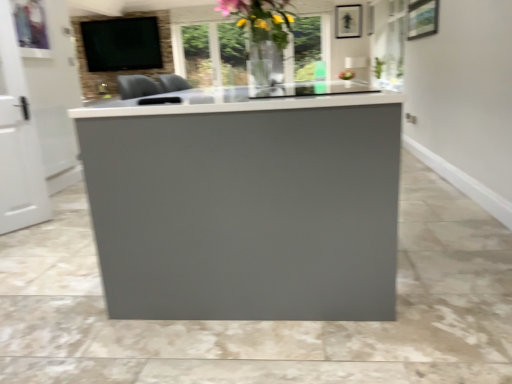
You are a GUI agent. You are given a task and a screenshot of the screen. Output one action in this format:
    pyautogui.click(x=<x>, y=<y>)
    Task: Click on the matte black tv at upper left
    
    Given the screenshot: What is the action you would take?
    pyautogui.click(x=122, y=44)

The height and width of the screenshot is (384, 512). I want to click on translucent glass vase at upper center, so click(263, 34).

The image size is (512, 384). Describe the element at coordinates (18, 141) in the screenshot. I see `white glossy door at left` at that location.

The height and width of the screenshot is (384, 512). Find the location of `matte black tv at upper left`. matte black tv at upper left is located at coordinates (122, 44).

Does point (9, 187) appear closer or farther from the camera than point (94, 56)?

Point (9, 187) is closer to the camera than point (94, 56).

From the picture: Looking at their sizes, would you say white glossy door at left is wider or thinner than matte black tv at upper left?

Considering their sizes, white glossy door at left looks slimmer than matte black tv at upper left.

How different are the orientations of white glossy door at left and matte black tv at upper left in degrees?

The facing directions of white glossy door at left and matte black tv at upper left are 57.9 degrees apart.

Which is closer, [257,74] or [2,229]?

The point [257,74] is closer to the camera.

Is translucent glass vase at upper center positioned before white glossy door at left?

Yes.

Is translucent glass vase at upper center far from white glossy door at left?

translucent glass vase at upper center is positioned a significant distance from white glossy door at left.

Would you say translucent glass vase at upper center is to the left or to the right of white glossy door at left in the picture?

translucent glass vase at upper center is positioned on white glossy door at left's right side.

Which point is more forward, (377,65) or (16,65)?

The point (16,65) is in front.

Would you say green leafy plant at upper right contains white glossy door at left?

That's incorrect, white glossy door at left is not inside green leafy plant at upper right.

Is green leafy plant at upper right facing away from white glossy door at left?

No, green leafy plant at upper right is not facing away from white glossy door at left.

From a real-world perspective, relative to white glossy door at left, is green leafy plant at upper right vertically above or below?

In terms of real-world spatial position, green leafy plant at upper right is above white glossy door at left.

Which of these two, translucent glass vase at upper center or green leafy plant at upper right, is bigger?

translucent glass vase at upper center is bigger.

Considering the positions of point (268, 31) and point (383, 69), is point (268, 31) closer or farther from the camera than point (383, 69)?

Point (268, 31) is positioned closer to the camera compared to point (383, 69).

Does translucent glass vase at upper center have a lesser height compared to green leafy plant at upper right?

Incorrect, the height of translucent glass vase at upper center does not fall short of that of green leafy plant at upper right.

Based on the photo, from the image's perspective, is translucent glass vase at upper center on top of green leafy plant at upper right?

Actually, translucent glass vase at upper center appears below green leafy plant at upper right in the image.

Looking at this image, based on their positions, is green leafy plant at upper right located to the left or right of translucent glass vase at upper center?

In the image, green leafy plant at upper right appears on the right side of translucent glass vase at upper center.

Is point (376, 77) positioned behind point (258, 18)?

Yes, it is.

From a real-world perspective, between green leafy plant at upper right and translucent glass vase at upper center, who is vertically lower?

In real-world perspective, green leafy plant at upper right is lower.

Is green leafy plant at upper right beside translucent glass vase at upper center?

No, green leafy plant at upper right is not making contact with translucent glass vase at upper center.

Which object is positioned more to the left, matte black tv at upper left or translucent glass vase at upper center?

Positioned to the left is matte black tv at upper left.

Is matte black tv at upper left inside or outside of translucent glass vase at upper center?

matte black tv at upper left exists outside the volume of translucent glass vase at upper center.

Does matte black tv at upper left touch translucent glass vase at upper center?

matte black tv at upper left and translucent glass vase at upper center are clearly separated.

Looking at the image, does matte black tv at upper left seem bigger or smaller compared to translucent glass vase at upper center?

Clearly, matte black tv at upper left is larger in size than translucent glass vase at upper center.

Which of these two, green leafy plant at upper right or matte black picture frame at upper center, is wider?

green leafy plant at upper right.

Is green leafy plant at upper right bigger or smaller than matte black picture frame at upper center?

Clearly, green leafy plant at upper right is larger in size than matte black picture frame at upper center.

Could you tell me if green leafy plant at upper right is turned towards matte black picture frame at upper center?

No.

At what (x,y) coordinates should I click in order to perform the action: click on glass door located underneath the matte black tv at upper left (from a real-world perspective). Please return your answer as a coordinate pair (x, y). The height and width of the screenshot is (384, 512). Looking at the image, I should click on (18, 141).

You are a GUI agent. You are given a task and a screenshot of the screen. Output one action in this format:
    pyautogui.click(x=<x>, y=<y>)
    Task: Click on the glass door below the translucent glass vase at upper center (from the image's perspective)
    The height and width of the screenshot is (384, 512).
    Given the screenshot: What is the action you would take?
    pyautogui.click(x=18, y=141)

Estimate the real-world distances between objects in this image. Which object is further from matte black picture frame at upper center, green leafy plant at upper right or matte black tv at upper left?

matte black tv at upper left lies further to matte black picture frame at upper center than the other object.

Looking at this image, considering their positions, is white glossy door at left positioned closer to matte black tv at upper left than matte black picture frame at upper center?

white glossy door at left is positioned closer to the anchor matte black tv at upper left.

From the image, which object appears to be farther from green leafy plant at upper right, white glossy door at left or matte black tv at upper left?

white glossy door at left is further to green leafy plant at upper right.

Considering their positions, is matte black picture frame at upper center positioned further to green leafy plant at upper right than white glossy door at left?

Among the two, white glossy door at left is located further to green leafy plant at upper right.

Looking at the image, which one is located closer to matte black tv at upper left, translucent glass vase at upper center or matte black picture frame at upper center?

The object closer to matte black tv at upper left is translucent glass vase at upper center.

Considering their positions, is green leafy plant at upper right positioned further to white glossy door at left than translucent glass vase at upper center?

green leafy plant at upper right lies further to white glossy door at left than the other object.

Considering their positions, is matte black tv at upper left positioned closer to green leafy plant at upper right than matte black picture frame at upper center?

matte black picture frame at upper center lies closer to green leafy plant at upper right than the other object.

Considering their positions, is green leafy plant at upper right positioned closer to white glossy door at left than matte black picture frame at upper center?

matte black picture frame at upper center.

At what (x,y) coordinates should I click in order to perform the action: click on picture frame between white glossy door at left and matte black tv at upper left in the front-back direction. Please return your answer as a coordinate pair (x, y). The height and width of the screenshot is (384, 512). Looking at the image, I should click on (348, 21).

Where is `plant between white glossy door at left and matte black tv at upper left in the front-back direction`? Image resolution: width=512 pixels, height=384 pixels. plant between white glossy door at left and matte black tv at upper left in the front-back direction is located at coordinates (378, 67).

Identify the location of picture frame between translucent glass vase at upper center and matte black tv at upper left from front to back. (348, 21).

Find the location of a particular element. plant between translucent glass vase at upper center and matte black tv at upper left in the front-back direction is located at coordinates (378, 67).